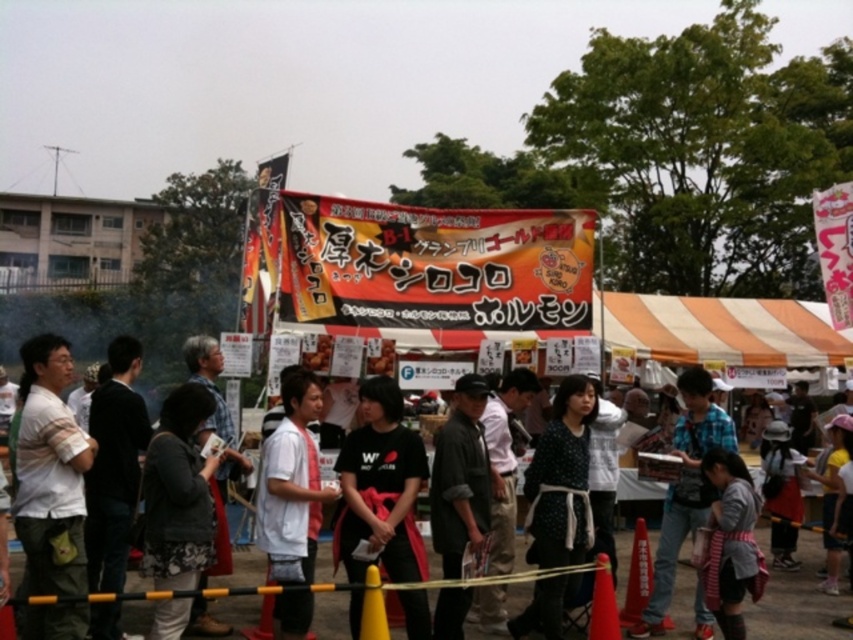
You are at the food festival and want to see the banner behind the people wearing the black matte shirt at center and white cotton shirt at center. Can you see the banner through them?

The black matte shirt at center is in front of the white cotton shirt at center, so the banner behind them would be partially obscured by both shirts.